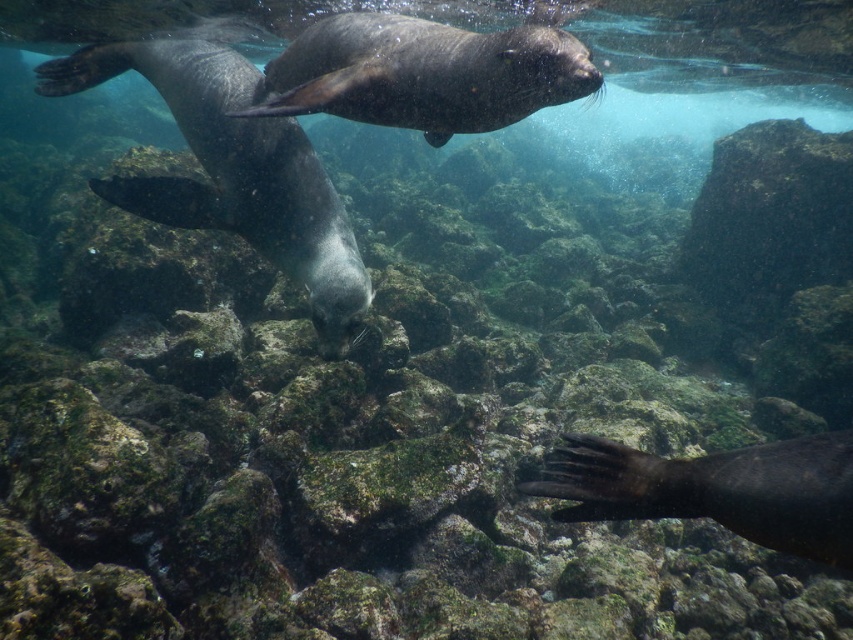
Question: Which of these objects is positioned farthest from the shiny dark fur seal at upper center?

Choices:
 (A) shiny gray seal at center
 (B) green mossy rock at upper right
 (C) dark gray fur seal at lower right

Answer: (B)

Question: Does shiny dark fur seal at upper center have a larger size compared to dark gray fur seal at lower right?

Choices:
 (A) yes
 (B) no

Answer: (A)

Question: Can you confirm if shiny dark fur seal at upper center is thinner than dark gray fur seal at lower right?

Choices:
 (A) no
 (B) yes

Answer: (A)

Question: Which object is the farthest from the shiny dark fur seal at upper center?

Choices:
 (A) dark gray fur seal at lower right
 (B) green mossy rock at upper right
 (C) shiny gray seal at center

Answer: (B)

Question: Which of the following is the farthest from the observer?

Choices:
 (A) dark gray fur seal at lower right
 (B) shiny gray seal at center

Answer: (B)

Question: Is shiny gray seal at center to the left of dark gray fur seal at lower right from the viewer's perspective?

Choices:
 (A) no
 (B) yes

Answer: (B)